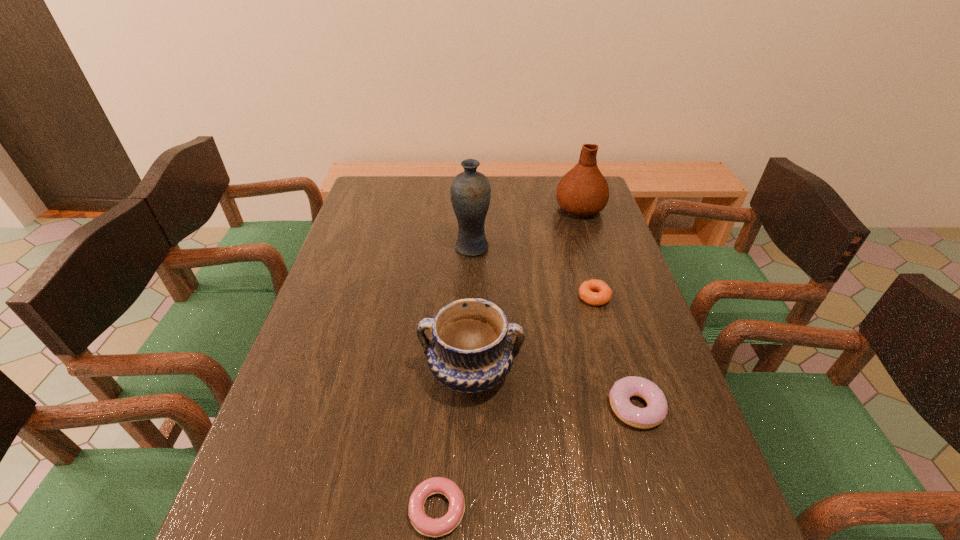
Where is `vacant space at the right edge of the desktop`? vacant space at the right edge of the desktop is located at coordinates (693, 469).

The image size is (960, 540). Find the location of `blank area at the far left corner`. blank area at the far left corner is located at coordinates (357, 206).

Find the location of a particular element. free spot between the fourth shortest object and the farthest doughnut is located at coordinates (533, 334).

Find the location of a particular element. This screenshot has width=960, height=540. free space between the vase and the second shortest doughnut is located at coordinates 533,272.

Where is `free spot between the farthest object and the vase`? free spot between the farthest object and the vase is located at coordinates (525, 228).

Locate an element on the screen. empty location between the farthest doughnut and the tallest object is located at coordinates (533, 272).

I want to click on free spot between the fifth shortest object and the tallest doughnut, so click(608, 308).

What are the coordinates of `empty space that is in between the pottery and the fifth shortest object` in the screenshot? It's located at (525, 290).

Find the location of a particular element. This screenshot has height=540, width=960. vacant area that lies between the tallest doughnut and the farthest doughnut is located at coordinates (615, 352).

You are a GUI agent. You are given a task and a screenshot of the screen. Output one action in this format:
    pyautogui.click(x=<x>, y=<y>)
    Task: Click on the unoccupied position between the vase and the farthest doughnut
    
    Given the screenshot: What is the action you would take?
    pyautogui.click(x=533, y=272)